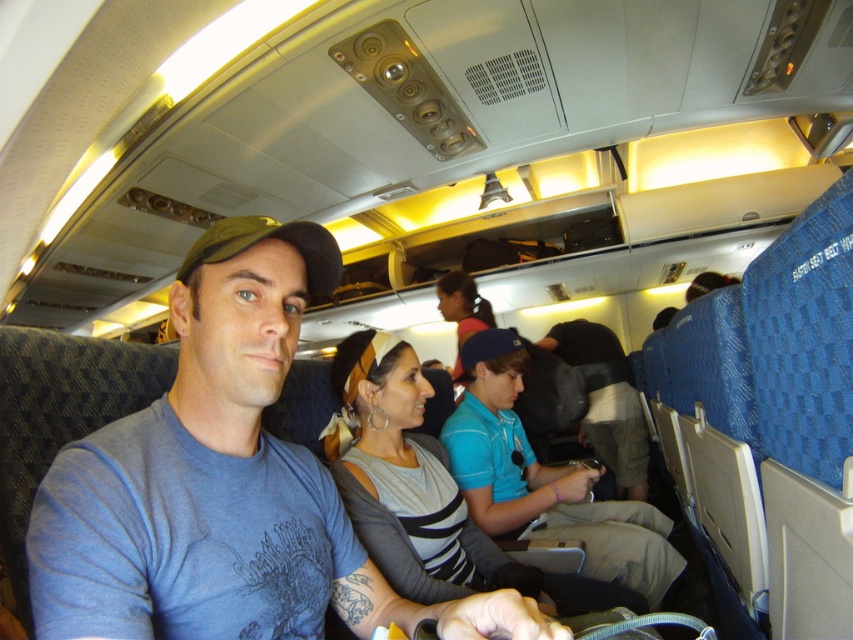
Question: Is matte blue t-shirt at center to the left of gray striped shirt at center from the viewer's perspective?

Choices:
 (A) no
 (B) yes

Answer: (B)

Question: Which point is farther from the camera taking this photo?

Choices:
 (A) (393, 600)
 (B) (613, 596)

Answer: (B)

Question: Does matte blue t-shirt at center have a larger size compared to gray striped shirt at center?

Choices:
 (A) yes
 (B) no

Answer: (B)

Question: Which point is closer to the camera taking this photo?

Choices:
 (A) (215, 332)
 (B) (357, 524)

Answer: (A)

Question: Considering the relative positions of matte blue t-shirt at center and gray striped shirt at center in the image provided, where is matte blue t-shirt at center located with respect to gray striped shirt at center?

Choices:
 (A) right
 (B) left

Answer: (B)